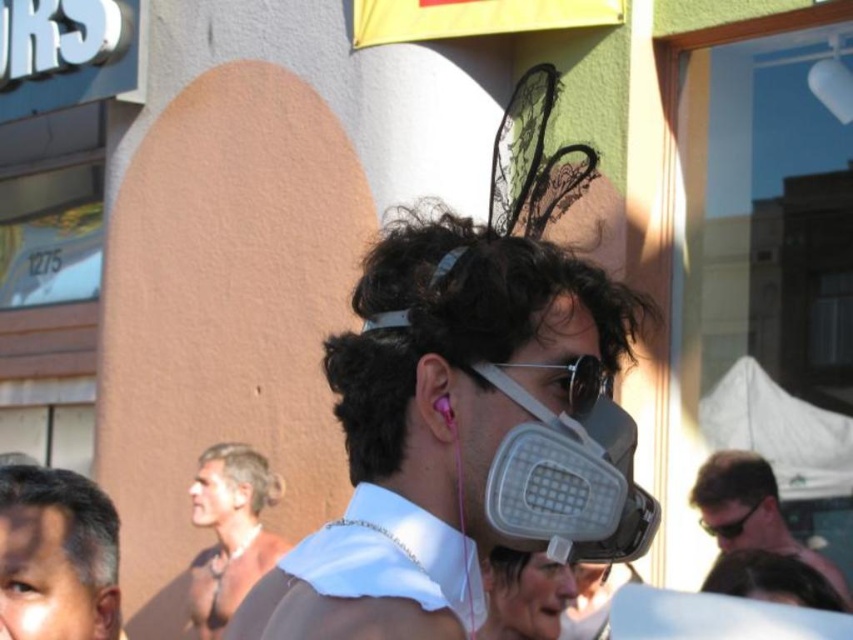
You are a photographer at the event and want to capture a closeup of the gray matte respirator at center and the dark brown curly hair at upper center. Considering their sizes, which object should you zoom in more on to ensure both are clearly visible in the photo?

The gray matte respirator at center has a larger size compared to the dark brown curly hair at upper center, so you should zoom in more on the gray matte respirator at center to ensure both are clearly visible in the photo.

You are a photographer trying to capture the person in the foreground. You notice the gray matte respirator at center and the light brown hair at center. Which object is positioned closer to you?

The gray matte respirator at center is closer to the viewer than the light brown hair at center.

You are a photographer trying to capture the person in the foreground. You want to ensure that both the gray matte respirator at center and the dark brown curly hair at upper center are clearly visible in your photo. Given their sizes, which object might require more careful framing to avoid being too large in the shot?

The gray matte respirator at center has a greater width than the dark brown curly hair at upper center, so it might require more careful framing to avoid being too large in the shot.